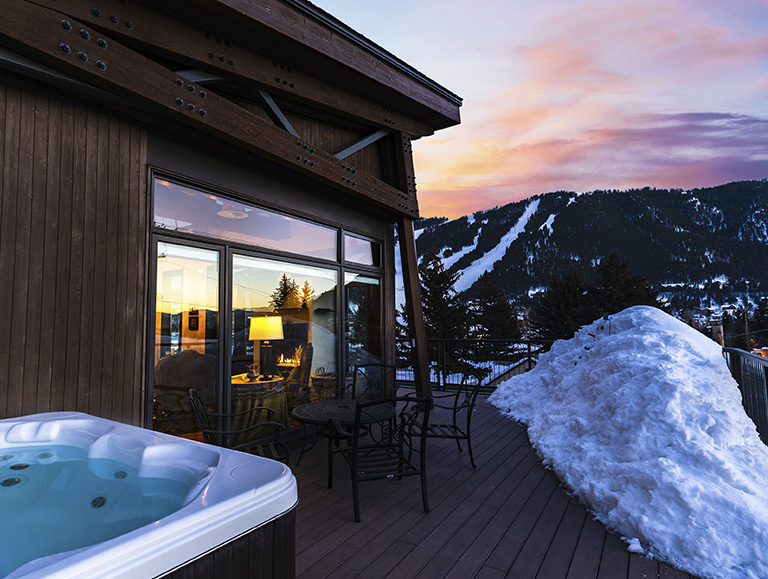
I want to click on table, so click(x=333, y=406).